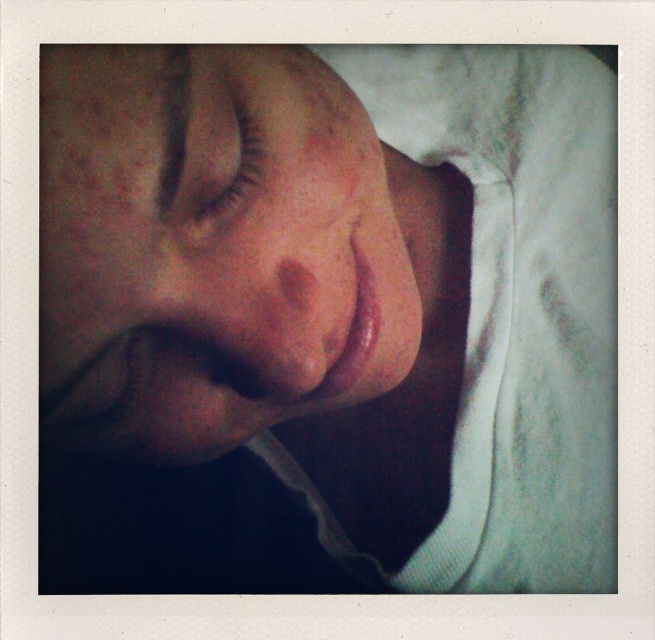
Question: Which object appears closest to the camera in this image?

Choices:
 (A) smooth skin face at center
 (B) brown matte eyelashes at upper center

Answer: (A)

Question: Which point appears closest to the camera in this image?

Choices:
 (A) (231, 148)
 (B) (81, 358)

Answer: (B)

Question: Which point is farther to the camera?

Choices:
 (A) smooth skin face at center
 (B) brown matte eyelashes at upper center

Answer: (B)

Question: Is smooth skin face at center thinner than brown matte eyelashes at upper center?

Choices:
 (A) no
 (B) yes

Answer: (A)

Question: Can you confirm if smooth skin face at center is thinner than brown matte eyelashes at upper center?

Choices:
 (A) yes
 (B) no

Answer: (B)

Question: Can you confirm if smooth skin face at center is positioned to the left of brown matte eyelashes at upper center?

Choices:
 (A) yes
 (B) no

Answer: (B)